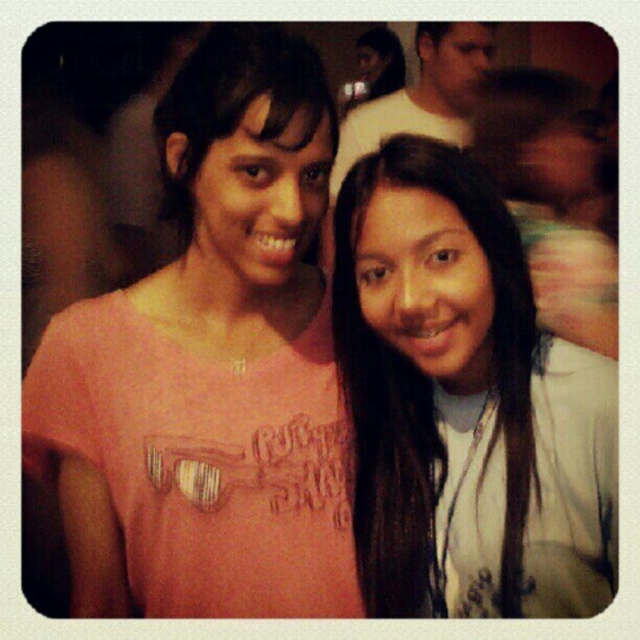
You are a photographer trying to adjust the lighting for a portrait. You notice two elements in the frame that might cast shadows on the subjects. The white matte hair at center and the matte white shirt at upper center. Which of these two items is positioned lower in the image?

The white matte hair at center is positioned lower in the image than the matte white shirt at upper center because it has a lesser height compared to it.